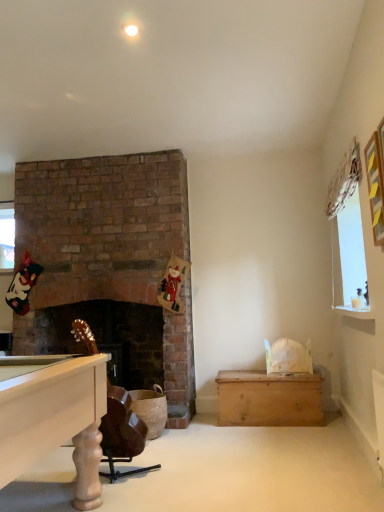
Question: Is brown leather rocking chair at lower left positioned in front of yellow paper picture frame at upper right?

Choices:
 (A) no
 (B) yes

Answer: (A)

Question: Is brown leather rocking chair at lower left not near yellow paper picture frame at upper right?

Choices:
 (A) yes
 (B) no

Answer: (A)

Question: Can you confirm if brown leather rocking chair at lower left is wider than yellow paper picture frame at upper right?

Choices:
 (A) yes
 (B) no

Answer: (A)

Question: From the image's perspective, is brown leather rocking chair at lower left below yellow paper picture frame at upper right?

Choices:
 (A) no
 (B) yes

Answer: (B)

Question: Is brown leather rocking chair at lower left shorter than yellow paper picture frame at upper right?

Choices:
 (A) no
 (B) yes

Answer: (A)

Question: From a real-world perspective, is wooden chest at lower right above or below brown leather rocking chair at lower left?

Choices:
 (A) below
 (B) above

Answer: (A)

Question: From the image's perspective, is wooden chest at lower right above or below brown leather rocking chair at lower left?

Choices:
 (A) below
 (B) above

Answer: (A)

Question: In the image, is wooden chest at lower right positioned in front of or behind brown leather rocking chair at lower left?

Choices:
 (A) behind
 (B) front

Answer: (A)

Question: Based on their positions, is wooden chest at lower right located to the left or right of brown leather rocking chair at lower left?

Choices:
 (A) left
 (B) right

Answer: (B)

Question: Which is correct: wooden chest at lower right is inside yellow paper picture frame at upper right, or outside of it?

Choices:
 (A) inside
 (B) outside

Answer: (B)

Question: Relative to yellow paper picture frame at upper right, is wooden chest at lower right in front or behind?

Choices:
 (A) behind
 (B) front

Answer: (A)

Question: Does point (264, 382) appear closer or farther from the camera than point (375, 132)?

Choices:
 (A) closer
 (B) farther

Answer: (B)

Question: Is wooden chest at lower right bigger or smaller than yellow paper picture frame at upper right?

Choices:
 (A) big
 (B) small

Answer: (A)

Question: Considering the positions of point (375, 197) and point (251, 377), is point (375, 197) closer or farther from the camera than point (251, 377)?

Choices:
 (A) farther
 (B) closer

Answer: (B)

Question: Is yellow paper picture frame at upper right situated inside wooden chest at lower right or outside?

Choices:
 (A) outside
 (B) inside

Answer: (A)